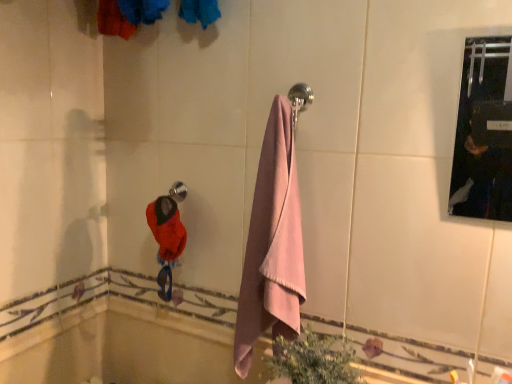
Question: Is pink cotton towel at center inside or outside of green leafy plant at lower center?

Choices:
 (A) inside
 (B) outside

Answer: (B)

Question: From their relative heights in the image, would you say pink cotton towel at center is taller or shorter than green leafy plant at lower center?

Choices:
 (A) tall
 (B) short

Answer: (A)

Question: Which is nearer to the pink cotton towel at center?

Choices:
 (A) polished chrome towel bar at upper center
 (B) soft blue fabric at upper center
 (C) green leafy plant at lower center

Answer: (C)

Question: Which is nearer to the soft blue fabric at upper center?

Choices:
 (A) green leafy plant at lower center
 (B) polished chrome towel bar at upper center
 (C) pink cotton towel at center

Answer: (B)